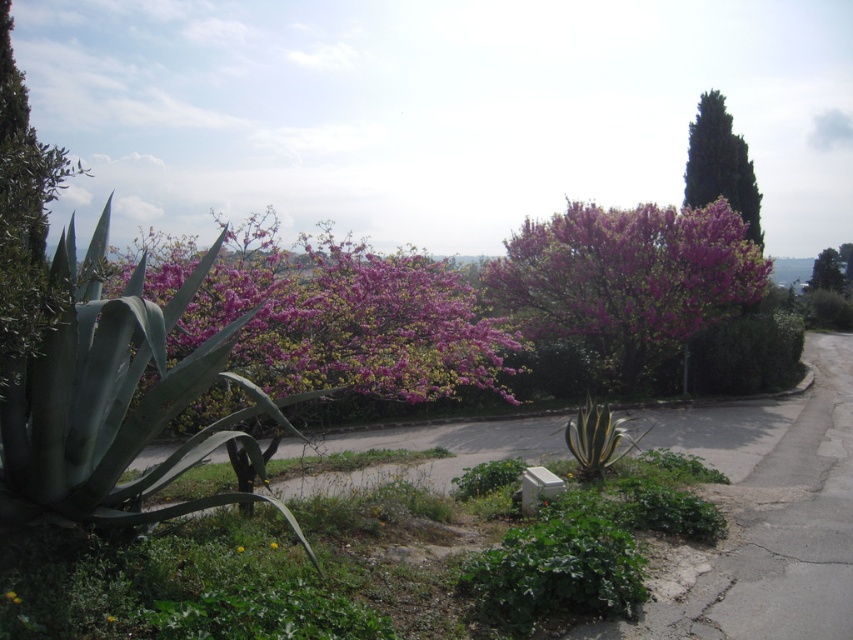
Question: Which object is the closest to the green leafy tree at upper right?

Choices:
 (A) pink bloom at center
 (B) green textured tree at upper right

Answer: (B)

Question: Which object is positioned closest to the pink bloom bush at center?

Choices:
 (A) green leafy tree at upper right
 (B) pink bloom at center
 (C) green textured tree at upper right

Answer: (C)

Question: Is green textured tree at upper right above green leafy tree at upper right?

Choices:
 (A) no
 (B) yes

Answer: (B)

Question: Does pink bloom at center come behind green leafy tree at upper right?

Choices:
 (A) yes
 (B) no

Answer: (B)

Question: Estimate the real-world distances between objects in this image. Which object is closer to the green textured tree at upper right?

Choices:
 (A) pink bloom bush at center
 (B) green leafy tree at upper right

Answer: (A)

Question: Does pink bloom at center appear over pink bloom bush at center?

Choices:
 (A) no
 (B) yes

Answer: (B)